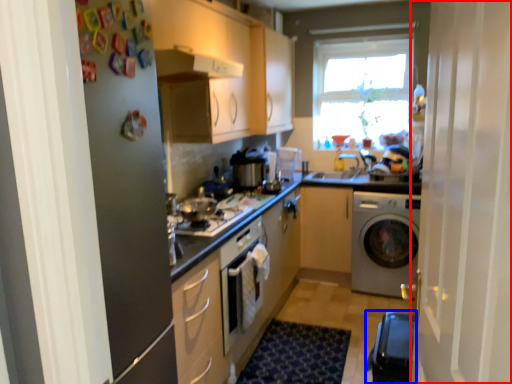
Question: Which of the following is the closest to the observer, screen door (highlighted by a red box) or water heater (highlighted by a blue box)?

Choices:
 (A) screen door
 (B) water heater

Answer: (A)